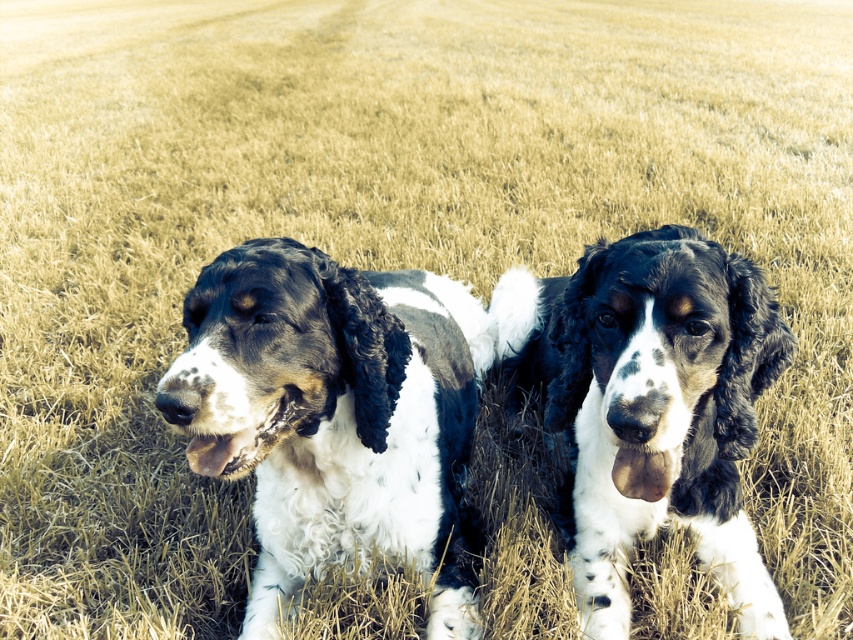
How distant is black and white fur dog at center from spotted fur dog at center?

A distance of 18.86 inches exists between black and white fur dog at center and spotted fur dog at center.

Between black and white fur dog at center and spotted fur dog at center, which one is positioned lower?

black and white fur dog at center is lower down.

The height and width of the screenshot is (640, 853). Find the location of `black and white fur dog at center`. black and white fur dog at center is located at coordinates tap(334, 413).